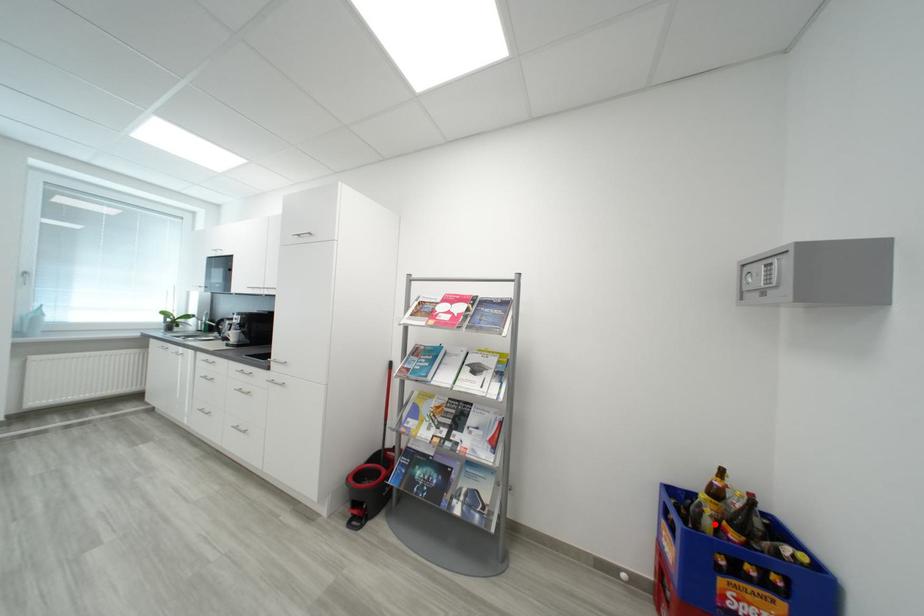
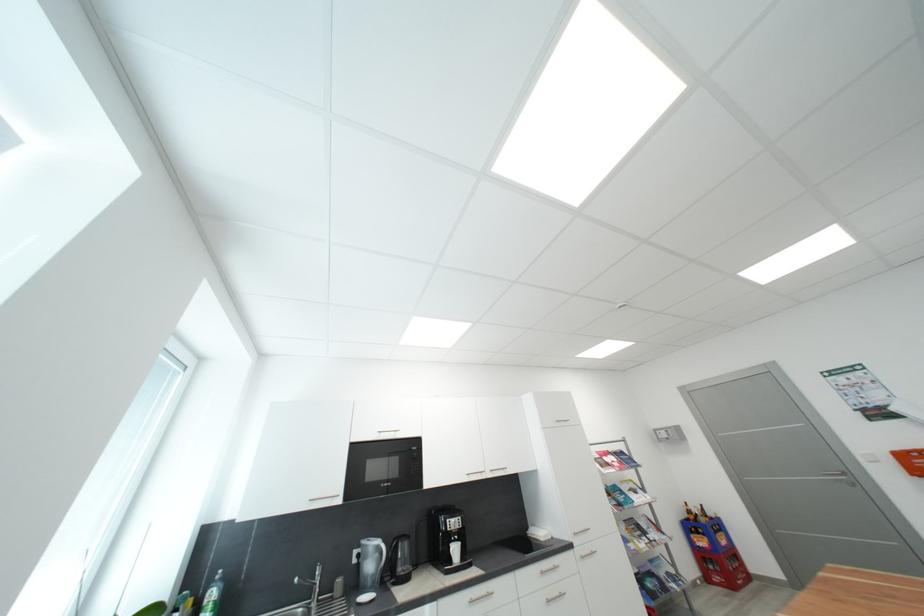
Question: A red point is marked in image1. In image2, is the corresponding 3D point closer to the camera or farther? Reply with the corresponding letter.

Choices:
 (A) The corresponding 3D point is closer.
 (B) The corresponding 3D point is farther.

Answer: (A)